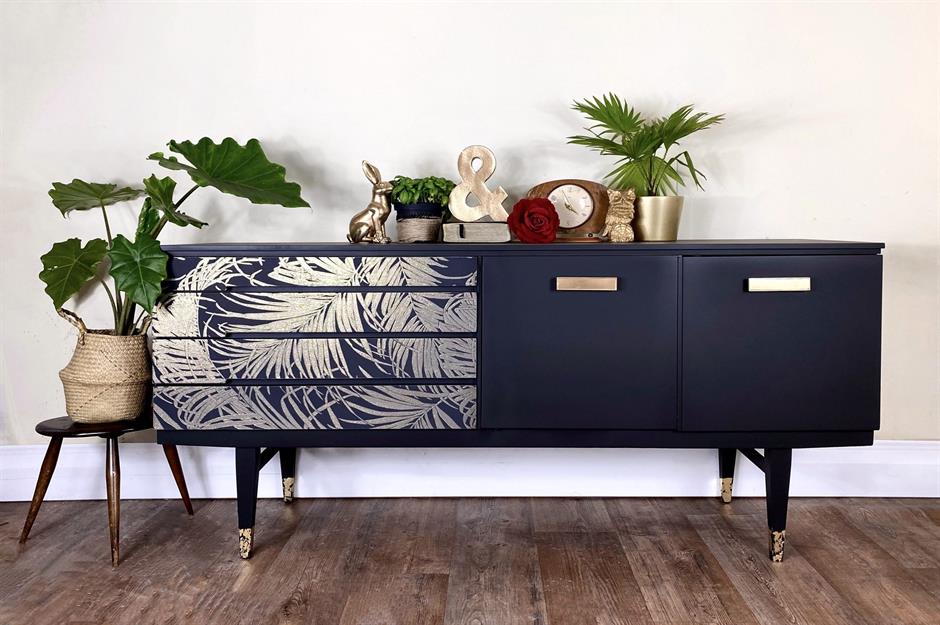
This screenshot has width=940, height=625. Find the location of `table decor`. table decor is located at coordinates (559, 335).